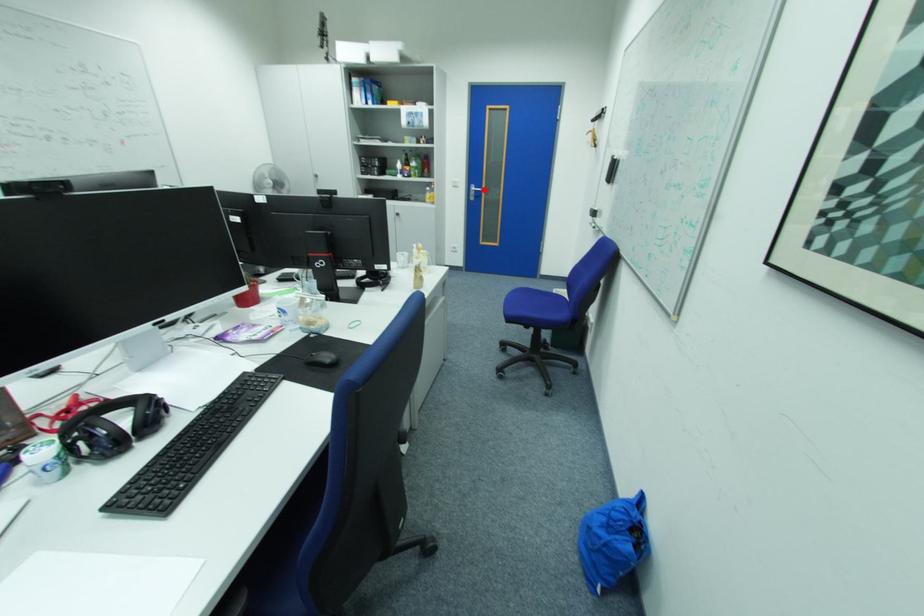
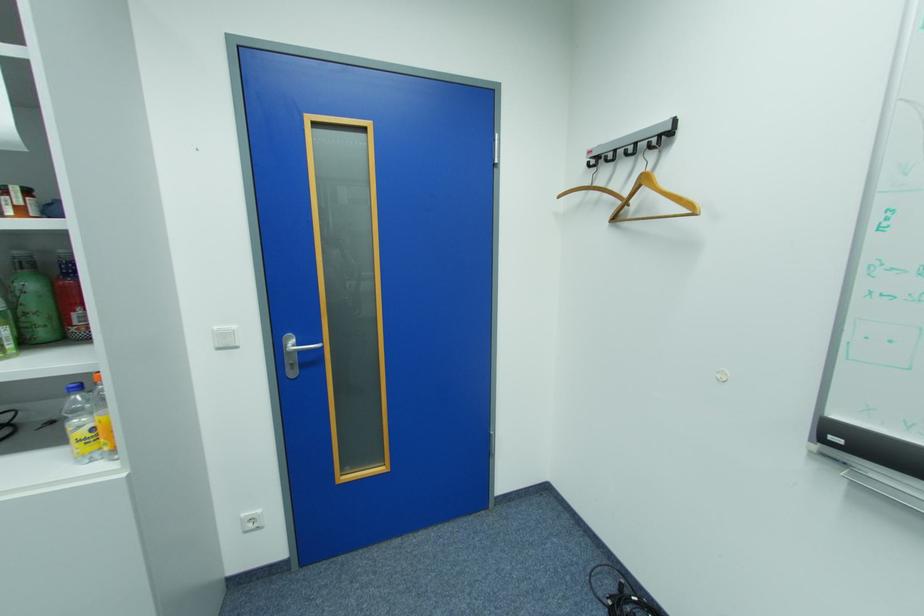
Question: I am providing you with two images of the same scene from different viewpoints. Image1 has a red point marked. In image2, the corresponding 3D location appears at what relative position? Reply with the corresponding letter.

Choices:
 (A) Closer
 (B) Farther

Answer: (B)